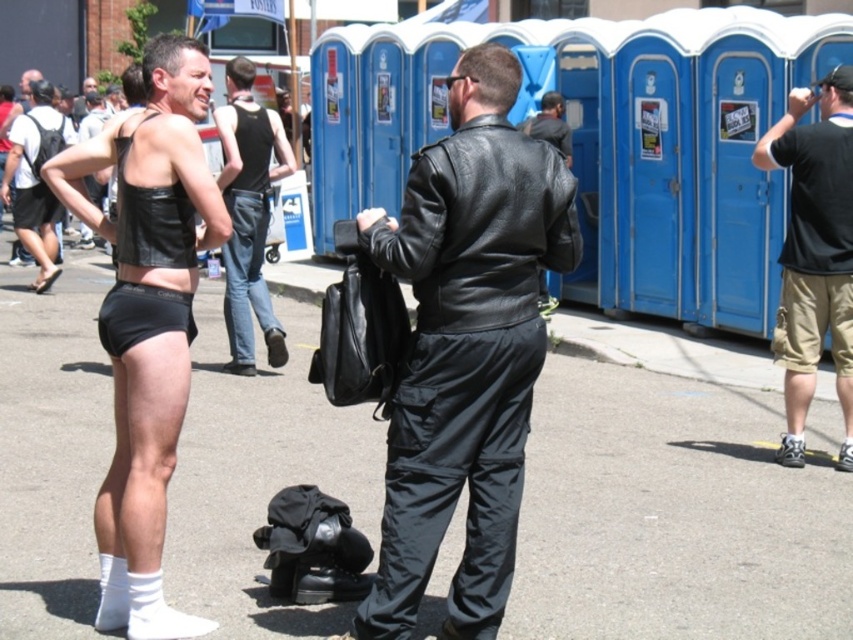
Looking at this image, you are a fashion designer observing the two individuals in the image. You need to determine which clothing item is shorter in length between the black cotton shorts at right and the leather tank top at center. Which one is shorter?

The black cotton shorts at right is shorter than the leather tank top at center, so the black cotton shorts at right is the shorter clothing item.

You are organizing a charity event and need to ensure proper sizing for participants. Given the black cotton shorts at right and the leather tank top at center, which item is more suitable for someone who prefers a snugger fit?

The black cotton shorts at right has a smaller size compared to the leather tank top at center, making it more suitable for someone who prefers a snugger fit.

You are a photographer at the event and need to capture a candid shot of both the black cotton shorts at right and the black matte underwear at center without any obstruction. Based on their positions, can you frame the shot so that neither object blocks the other?

The black matte underwear at center is behind the black cotton shorts at right, so it will be obstructed. You cannot frame the shot without one blocking the other.